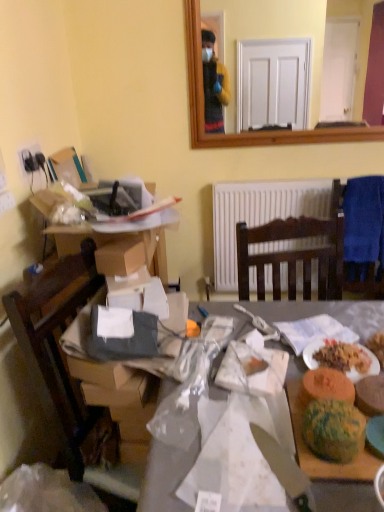
Find the location of a particular element. This screenshot has width=384, height=512. vacant position to the left of silver metallic knife at center is located at coordinates (213, 467).